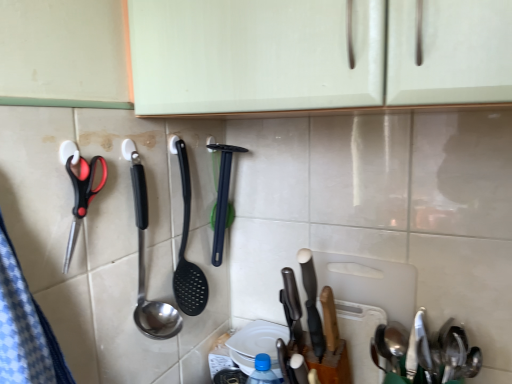
Describe the element at coordinates (425, 353) in the screenshot. This screenshot has height=384, width=512. I see `satin silver spoon at lower right, which appears as the second spoon when viewed from the left` at that location.

Identify the location of white glossy plate at center. (255, 342).

Image resolution: width=512 pixels, height=384 pixels. Find the location of `black plastic spatula at center`. black plastic spatula at center is located at coordinates (222, 198).

Image resolution: width=512 pixels, height=384 pixels. Find the location of `polished stainless steel spoon at center, which is the first spoon in top-to-bottom order`. polished stainless steel spoon at center, which is the first spoon in top-to-bottom order is located at coordinates (144, 262).

You are a GUI agent. You are given a task and a screenshot of the screen. Output one action in this format:
    pyautogui.click(x=<x>, y=<y>)
    Task: Click on the white matte cutting board at center-right
    The image size is (512, 384).
    Given the screenshot: What is the action you would take?
    pyautogui.click(x=366, y=302)

Is polished stainless steel knife at center to the left of white glossy plate at center from the viewer's perspective?

No.

Is point (315, 312) closer to camera compared to point (244, 367)?

Yes.

Looking at this image, considering the sizes of objects polished stainless steel knife at center and white glossy plate at center in the image provided, who is thinner, polished stainless steel knife at center or white glossy plate at center?

Thinner between the two is polished stainless steel knife at center.

Would you say white glossy plate at center is part of polished stainless steel knife at center's contents?

No, white glossy plate at center is not surrounded by polished stainless steel knife at center.

Is white glossy plate at center inside or outside of polished stainless steel spoon at center, the second spoon from the bottom?

white glossy plate at center lies outside polished stainless steel spoon at center, the second spoon from the bottom.

Considering the relative sizes of white glossy plate at center and polished stainless steel spoon at center, which is the first spoon in top-to-bottom order, in the image provided, is white glossy plate at center bigger than polished stainless steel spoon at center, which is the first spoon in top-to-bottom order,?

Incorrect, white glossy plate at center is not larger than polished stainless steel spoon at center, which is the first spoon in top-to-bottom order.

Is white glossy plate at center aimed at polished stainless steel spoon at center, which is the first spoon in top-to-bottom order?

No, white glossy plate at center is not aimed at polished stainless steel spoon at center, which is the first spoon in top-to-bottom order.

How different are the orientations of white glossy plate at center and polished stainless steel spoon at center, positioned as the 2th spoon in right-to-left order, in degrees?

90.9 degrees separate the facing orientations of white glossy plate at center and polished stainless steel spoon at center, positioned as the 2th spoon in right-to-left order.

What's the angular difference between white matte cutting board at center-right and polished stainless steel knife at center's facing directions?

white matte cutting board at center-right and polished stainless steel knife at center are facing 1.5 degrees away from each other.

Does point (338, 305) lie behind point (309, 264)?

Yes, point (338, 305) is farther from viewer.

Is white matte cutting board at center-right closer to the viewer compared to polished stainless steel knife at center?

No, the depth of white matte cutting board at center-right is greater than that of polished stainless steel knife at center.

Is black plastic spatula at center positioned in front of polished stainless steel knife at center?

No, the depth of black plastic spatula at center is greater than that of polished stainless steel knife at center.

Is black plastic spatula at center placed right next to polished stainless steel knife at center?

black plastic spatula at center and polished stainless steel knife at center are not in contact.

Consider the image. In terms of width, does black plastic spatula at center look wider or thinner when compared to polished stainless steel knife at center?

Clearly, black plastic spatula at center has more width compared to polished stainless steel knife at center.

Is point (222, 150) less distant than point (303, 257)?

No.

Between point (458, 362) and point (329, 283), which one is positioned behind?

The point (329, 283) is more distant.

Is satin silver spoon at lower right, the second spoon viewed from the top, inside or outside of white matte cutting board at center-right?

satin silver spoon at lower right, the second spoon viewed from the top, is spatially situated outside white matte cutting board at center-right.

Would you consider satin silver spoon at lower right, the second spoon viewed from the top, to be distant from white matte cutting board at center-right?

That's not correct — satin silver spoon at lower right, the second spoon viewed from the top, is a little close to white matte cutting board at center-right.

Which of these two, satin silver spoon at lower right, which appears as the first spoon when ordered from the bottom, or white matte cutting board at center-right, is smaller?

white matte cutting board at center-right.

Is satin silver spoon at lower right, the second spoon viewed from the top, further to the viewer compared to polished stainless steel knife at center?

No, it is in front of polished stainless steel knife at center.

Which is closer, (421, 378) or (319, 316)?

The point (319, 316) is in front.

From a real-world perspective, which is physically above, satin silver spoon at lower right, which appears as the first spoon when ordered from the bottom, or polished stainless steel knife at center?

polished stainless steel knife at center, from a real-world perspective.

Is satin silver spoon at lower right, the second spoon viewed from the top, far away from polished stainless steel knife at center?

No.

What's the angular difference between polished stainless steel spoon at center, which is the first spoon in top-to-bottom order, and black plastic spatula at center's facing directions?

The angle between the facing direction of polished stainless steel spoon at center, which is the first spoon in top-to-bottom order, and the facing direction of black plastic spatula at center is 0.982 degrees.

Locate an element on the screen. spatula behind the polished stainless steel spoon at center, the second spoon from the bottom is located at coordinates (222, 198).

In the image, is polished stainless steel spoon at center, the second spoon from the bottom, positioned in front of or behind black plastic spatula at center?

polished stainless steel spoon at center, the second spoon from the bottom, is in front of black plastic spatula at center.

Who is bigger, polished stainless steel spoon at center, which is the first spoon in top-to-bottom order, or black plastic spatula at center?

With larger size is polished stainless steel spoon at center, which is the first spoon in top-to-bottom order.

At what (x,y) coordinates should I click in order to perform the action: click on plate located behind the polished stainless steel knife at center. Please return your answer as a coordinate pair (x, y). Looking at the image, I should click on (255, 342).

At what (x,y) coordinates should I click in order to perform the action: click on plate below the polished stainless steel spoon at center, positioned as the 2th spoon in right-to-left order (from the image's perspective). Please return your answer as a coordinate pair (x, y). The image size is (512, 384). Looking at the image, I should click on (255, 342).

Looking at the image, which one is located closer to polished stainless steel spoon at center, which is the first spoon in top-to-bottom order, polished stainless steel knife at center or white matte cutting board at center-right?

Based on the image, polished stainless steel knife at center appears to be nearer to polished stainless steel spoon at center, which is the first spoon in top-to-bottom order.

Based on their spatial positions, is polished stainless steel knife at center or black plastic spatula at center further from white glossy plate at center?

black plastic spatula at center lies further to white glossy plate at center than the other object.

Estimate the real-world distances between objects in this image. Which object is closer to black plastic spatula at center, white glossy plate at center or polished stainless steel knife at center?

The object closer to black plastic spatula at center is white glossy plate at center.

From the image, which object appears to be farther from polished stainless steel knife at center, white glossy plate at center or polished stainless steel spoon at center, which is counted as the first spoon, starting from the left?

Among the two, polished stainless steel spoon at center, which is counted as the first spoon, starting from the left, is located further to polished stainless steel knife at center.

Looking at this image, estimate the real-world distances between objects in this image. Which object is closer to satin silver spoon at lower right, which appears as the second spoon when viewed from the left, polished stainless steel spoon at center, which is counted as the first spoon, starting from the left, or white glossy plate at center?

white glossy plate at center is positioned closer to the anchor satin silver spoon at lower right, which appears as the second spoon when viewed from the left.

Estimate the real-world distances between objects in this image. Which object is closer to polished stainless steel knife at center, satin silver spoon at lower right, which appears as the second spoon when viewed from the left, or black plastic spatula at center?

satin silver spoon at lower right, which appears as the second spoon when viewed from the left.

Based on their spatial positions, is polished stainless steel knife at center or polished stainless steel spoon at center, the second spoon from the bottom, further from white glossy plate at center?

polished stainless steel spoon at center, the second spoon from the bottom.

Based on their spatial positions, is satin silver spoon at lower right, which appears as the second spoon when viewed from the left, or black plastic spatula at center closer to polished stainless steel spoon at center, the second spoon from the bottom?

black plastic spatula at center lies closer to polished stainless steel spoon at center, the second spoon from the bottom, than the other object.

Find the location of a particular element. This screenshot has height=384, width=512. silverware located between white glossy plate at center and satin silver spoon at lower right, which appears as the second spoon when viewed from the left, in the left-right direction is located at coordinates (312, 302).

This screenshot has width=512, height=384. I want to click on cutting board between polished stainless steel spoon at center, which is counted as the first spoon, starting from the left, and satin silver spoon at lower right, which appears as the second spoon when viewed from the left, in the horizontal direction, so click(x=366, y=302).

Locate an element on the screen. This screenshot has height=384, width=512. silverware between polished stainless steel spoon at center, positioned as the 2th spoon in right-to-left order, and satin silver spoon at lower right, which ranks as the 1th spoon in right-to-left order, in the horizontal direction is located at coordinates (312, 302).

Identify the location of cutting board between black plastic spatula at center and white glossy plate at center in the vertical direction. (366, 302).